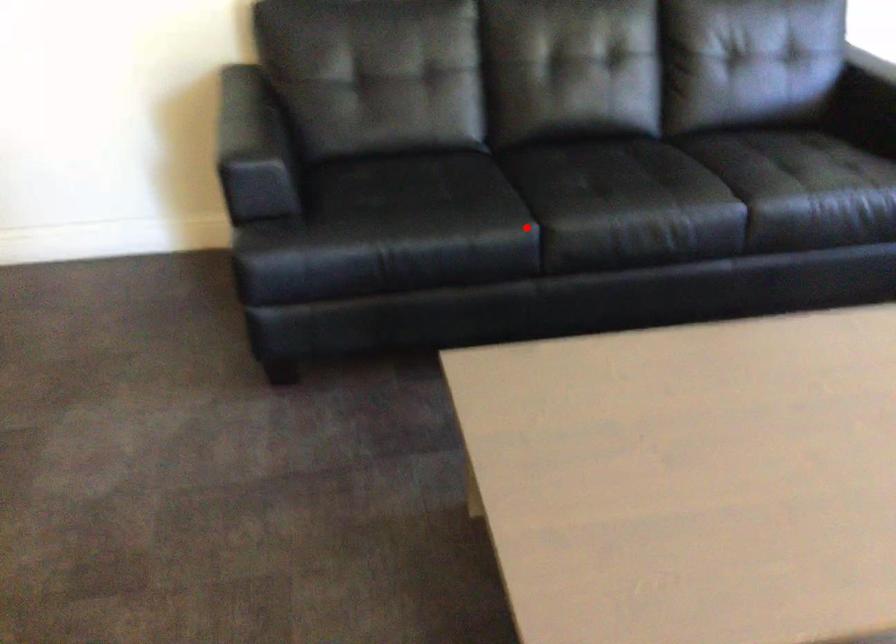
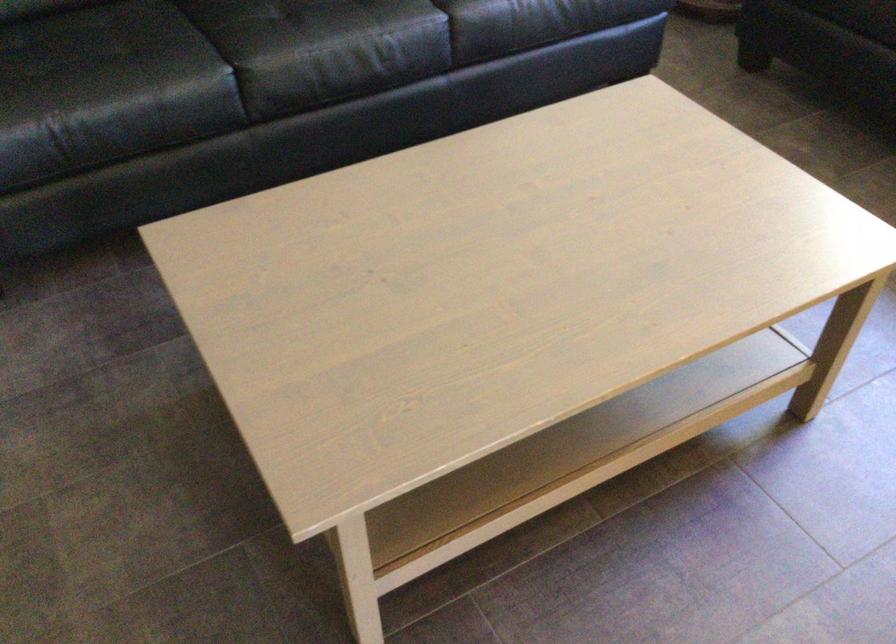
Where in the second image is the point corresponding to the highlighted location from the first image?

(221, 78)